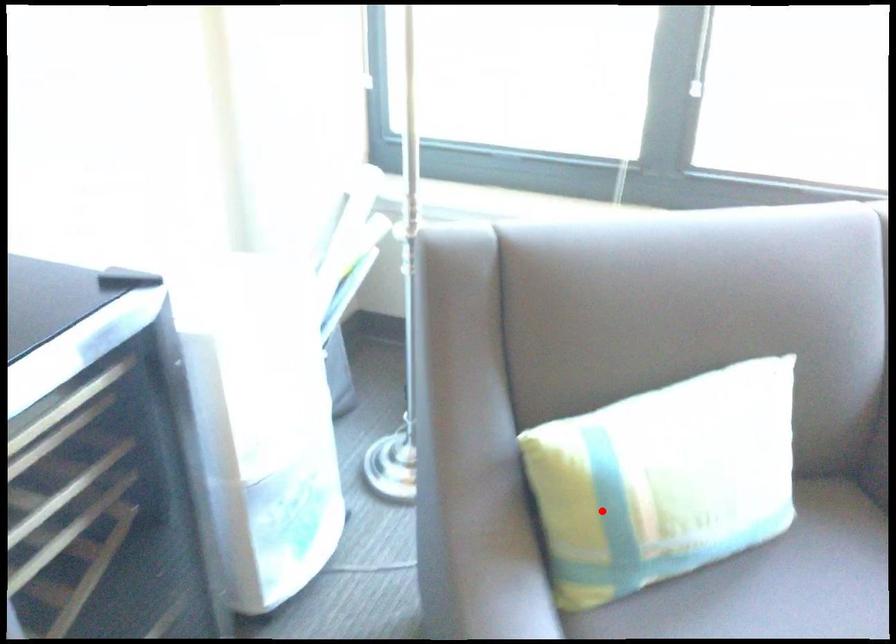
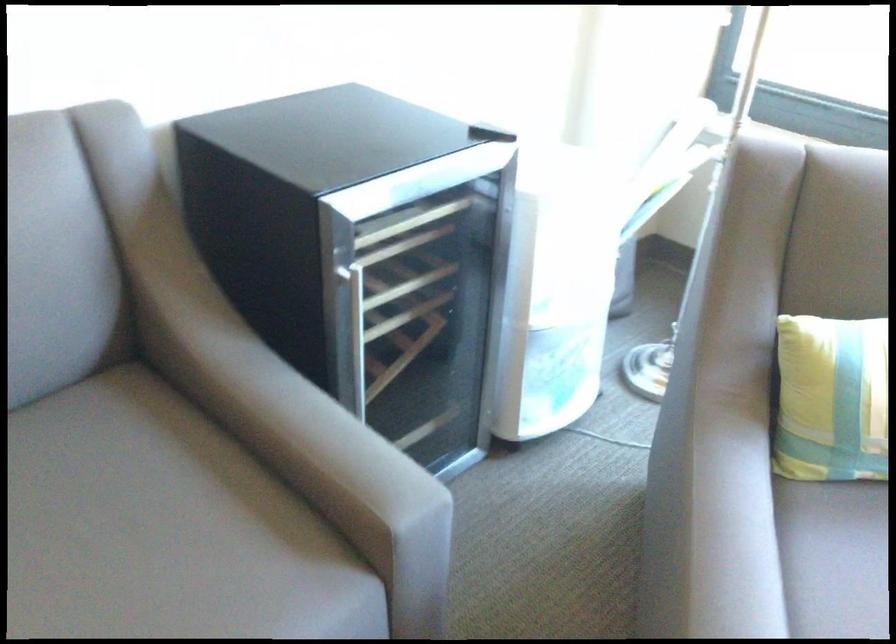
Question: A red point is marked in image1. In image2, is the corresponding 3D point closer to the camera or farther? Reply with the corresponding letter.

Choices:
 (A) The corresponding 3D point is closer.
 (B) The corresponding 3D point is farther.

Answer: (B)